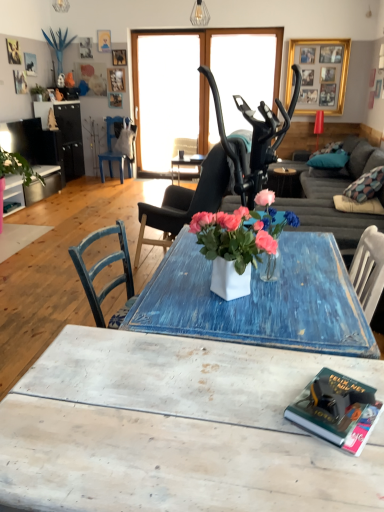
Image resolution: width=384 pixels, height=512 pixels. Identify the location of free area behind hardcover book at lower right. pyautogui.click(x=307, y=366).